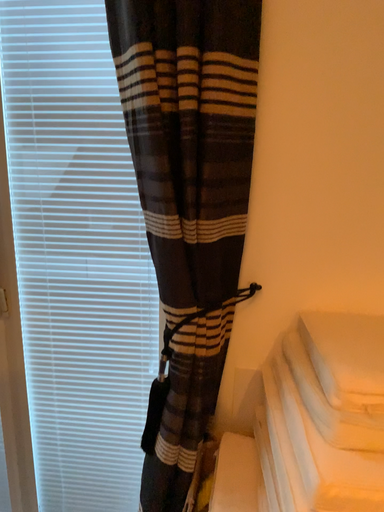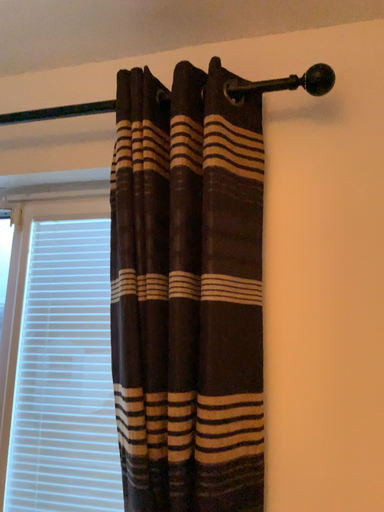
Question: Which way did the camera rotate in the video?

Choices:
 (A) rotated downward
 (B) rotated upward

Answer: (B)